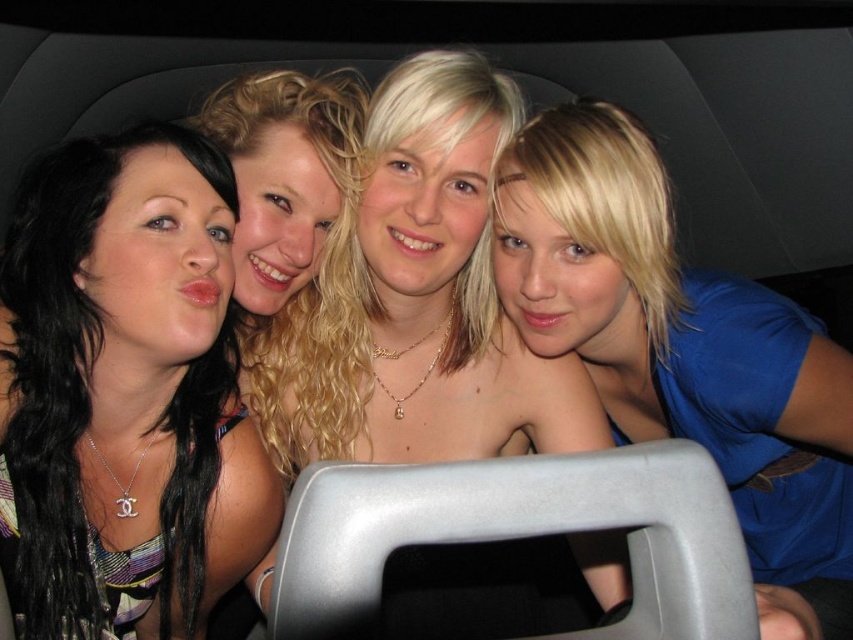
You are a photographer trying to capture a group photo of the matte black hair at left and the blue matte shirt at upper right. You want to ensure both subjects are in focus. Given that your camera can only focus on objects within a 30 cm width range, can you determine if both subjects will be in focus?

The matte black hair at left has a width less than the blue matte shirt at upper right. Since the camera can focus on objects within a 30 cm width range, and the difference in their widths is within that range, both subjects will be in focus.

You are a photographer adjusting the lighting in a vehicle. You have a spotlight that can only illuminate a specific point in the image. The coordinates given are point (125, 394). According to the scene description, what object will be highlighted by this spotlight?

The point (125, 394) corresponds to the matte black hair at left, so the spotlight will highlight the matte black hair at left.